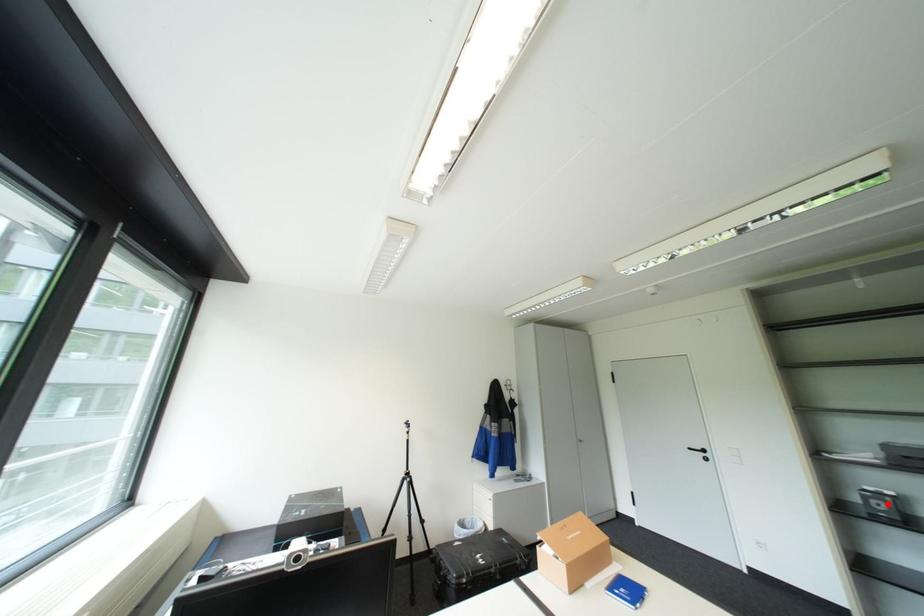
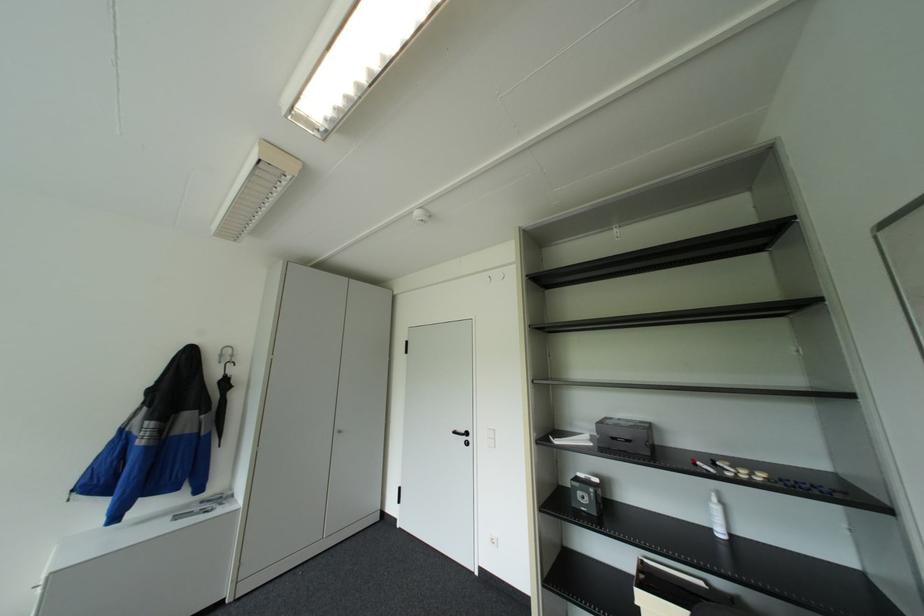
Question: I am providing you with two images of the same scene from different viewpoints. Image1 has a red point marked. In image2, the corresponding 3D location appears at what relative position? Reply with the corresponding letter.

Choices:
 (A) Closer
 (B) Farther

Answer: (B)